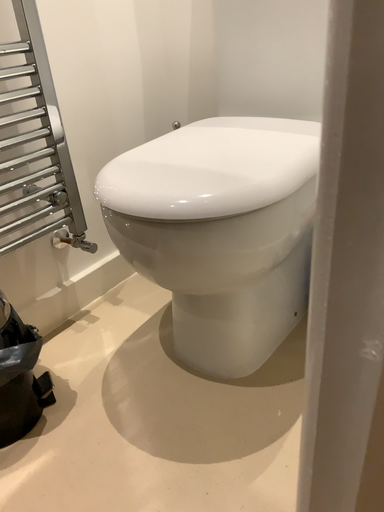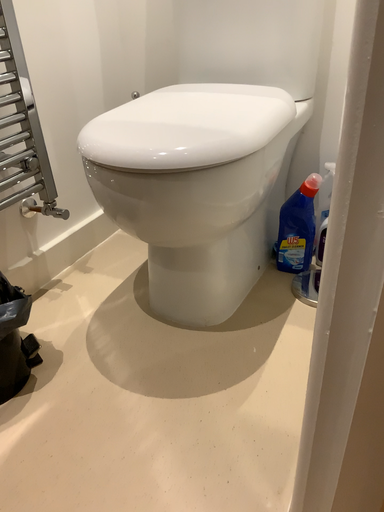
Question: How did the camera likely rotate when shooting the video?

Choices:
 (A) rotated left
 (B) rotated right

Answer: (B)